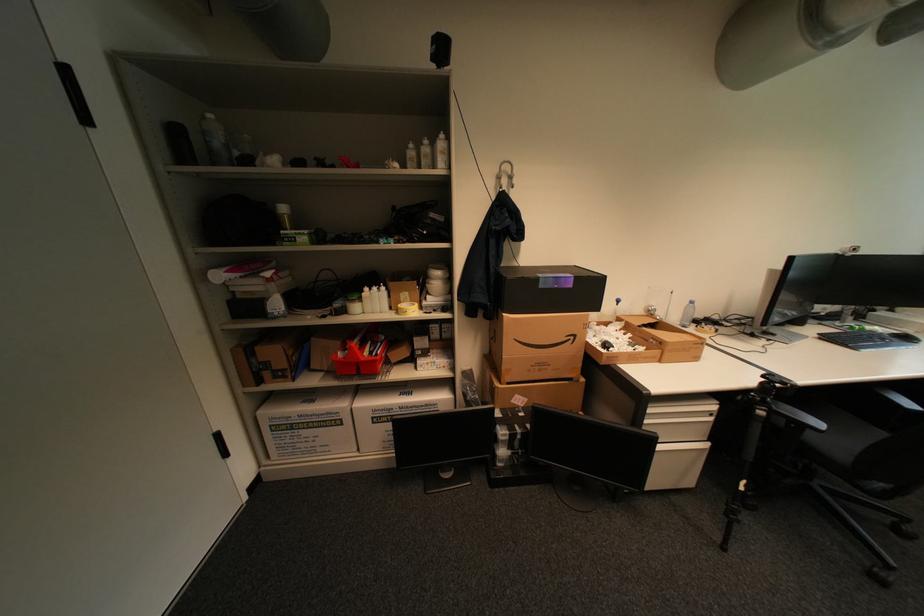
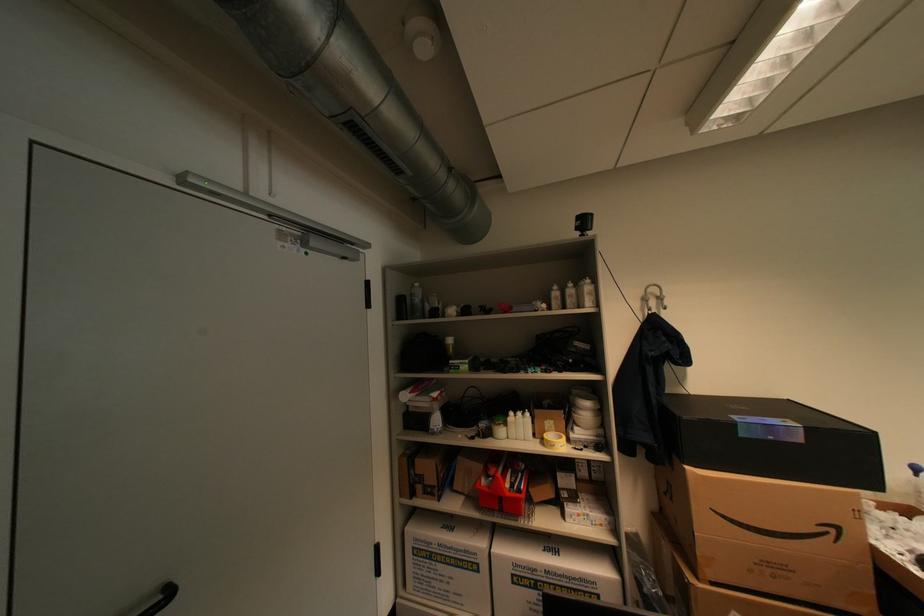
The point at (299, 427) is marked in the first image. Where is the corresponding point in the second image?

(439, 556)